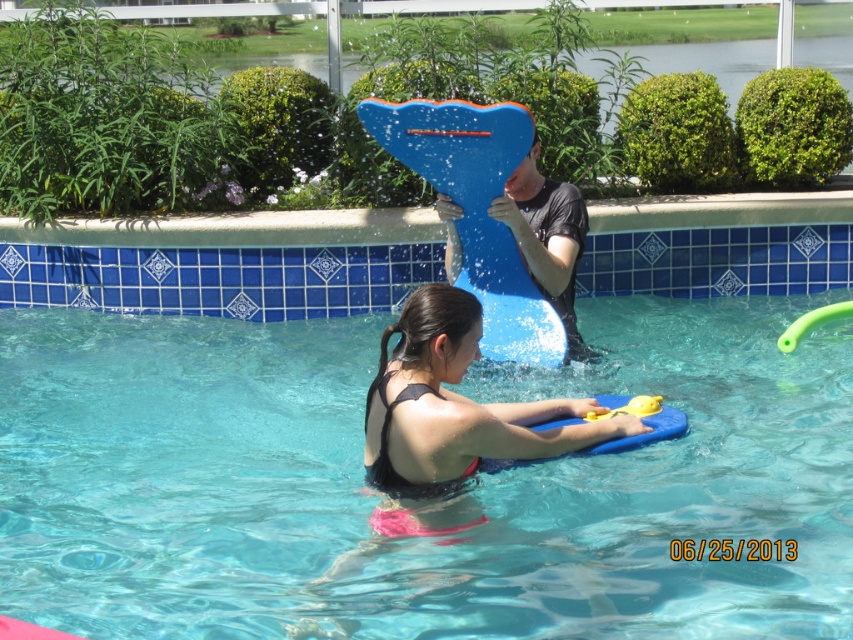
You are a swimmer who wants to jump into the pool. Based on the scene, where is the blue glossy pool at center in relation to the matte black swimsuit at center?

The blue glossy pool at center is below the matte black swimsuit at center, so you can safely jump into the pool from where the swimsuit is positioned.

You are a lifeguard observing the swimming pool. There is a point at coordinate (456, 404) where an object is located. What is the object at that point?

The object at point (456, 404) is the matte black swimsuit at center.

You are a photographer trying to capture the blue glossy pool at center and the matte black swimsuit at center in the same frame. Based on their positions, which object should you adjust your camera to focus on first if you want to include both in your shot?

The blue glossy pool at center is to the right of the matte black swimsuit at center, so you should focus on the matte black swimsuit at center first to ensure both are in frame.